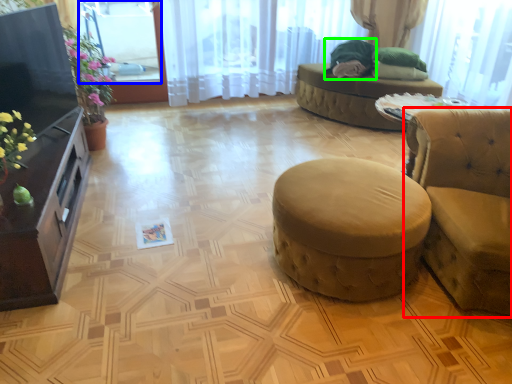
Question: Based on their relative distances, which object is nearer to studio couch (highlighted by a red box)? Choose from window screen (highlighted by a blue box) and open (highlighted by a green box).

Choices:
 (A) window screen
 (B) open

Answer: (B)